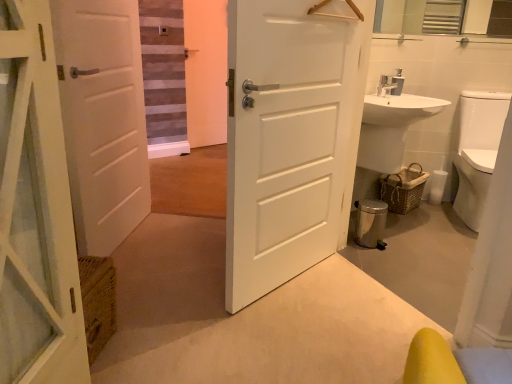
Question: Based on their positions, is white glossy sink at right located to the left or right of woven brown basket at lower right?

Choices:
 (A) right
 (B) left

Answer: (B)

Question: Based on their sizes in the image, would you say white glossy sink at right is bigger or smaller than woven brown basket at lower right?

Choices:
 (A) small
 (B) big

Answer: (B)

Question: Which object is the farthest from the white glossy sink at right?

Choices:
 (A) white glossy toilet bowl at right
 (B) woven brown basket at lower right
 (C) white matte door at center, the 2th door in the left-to-right sequence
 (D) white matte door at left, placed as the second door when sorted from right to left

Answer: (D)

Question: Estimate the real-world distances between objects in this image. Which object is farther from the white matte door at center, which is the 1th door in right-to-left order?

Choices:
 (A) white glossy sink at right
 (B) woven brown basket at lower right
 (C) white glossy toilet bowl at right
 (D) white matte door at left, placed as the second door when sorted from right to left

Answer: (C)